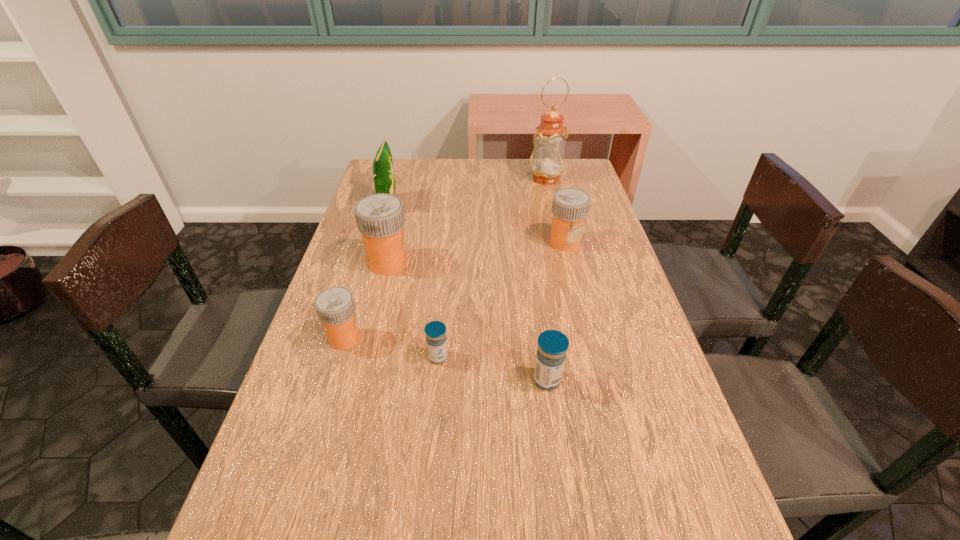
Find the location of a particular element. This screenshot has width=960, height=540. empty location between the rightmost orange medicine and the bigger blue medicine is located at coordinates (556, 311).

I want to click on free spot between the shortest medicine and the tallest medicine, so click(x=413, y=310).

What are the coordinates of `object that stands as the second closest to the second tallest medicine` in the screenshot? It's located at (380, 219).

In order to click on object that is the fourth closest one to the right blue medicine in this screenshot , I will do [x=380, y=219].

Where is `medicine that can be found as the third closest to the tallest medicine`? medicine that can be found as the third closest to the tallest medicine is located at coordinates (570, 206).

Locate which medicine ranks in proximity to the green crisp (potato chip). Please provide its 2D coordinates. Your answer should be formatted as a tuple, i.e. [(x, y)], where the tuple contains the x and y coordinates of a point satisfying the conditions above.

[(380, 219)]

Point out which orange medicine is positioned as the second nearest to the biggest orange medicine. Please provide its 2D coordinates. Your answer should be formatted as a tuple, i.e. [(x, y)], where the tuple contains the x and y coordinates of a point satisfying the conditions above.

[(570, 206)]

You are a GUI agent. You are given a task and a screenshot of the screen. Output one action in this format:
    pyautogui.click(x=<x>, y=<y>)
    Task: Click on the orange medicine that is the second closest to the fourth object from right to left
    Image resolution: width=960 pixels, height=540 pixels.
    Given the screenshot: What is the action you would take?
    pyautogui.click(x=380, y=219)

The width and height of the screenshot is (960, 540). What are the coordinates of `blank area in the image that satisfies the following two spatial constraints: 1. on the front side of the oil lamp; 2. on the front-facing side of the crisp (potato chip)` in the screenshot? It's located at point(551,205).

This screenshot has height=540, width=960. Find the location of `free space that satisfies the following two spatial constraints: 1. on the label side of the fourth tallest object; 2. on the label side of the tallest medicine`. free space that satisfies the following two spatial constraints: 1. on the label side of the fourth tallest object; 2. on the label side of the tallest medicine is located at coordinates (570, 262).